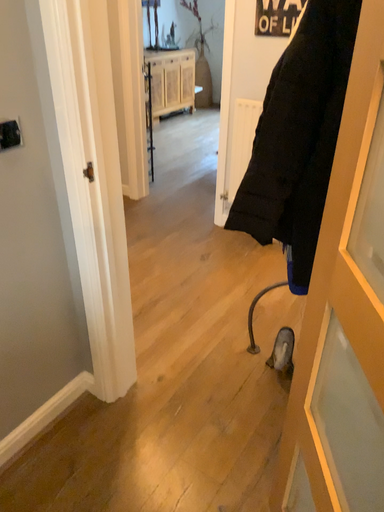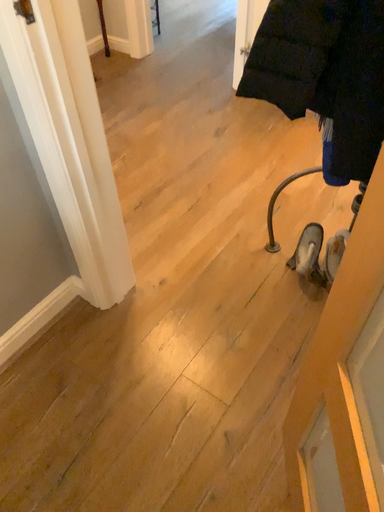
Question: Which way did the camera rotate in the video?

Choices:
 (A) rotated upward
 (B) rotated downward

Answer: (B)